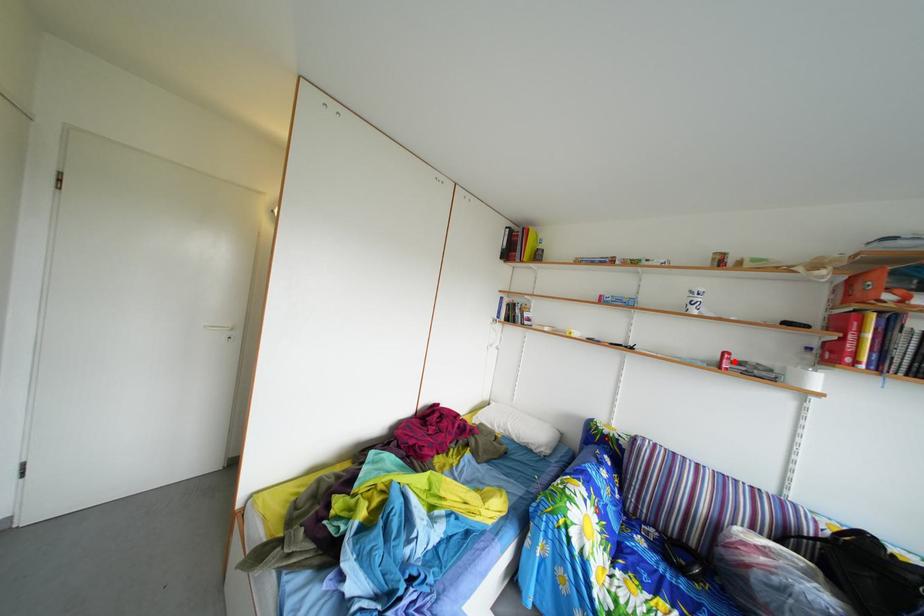
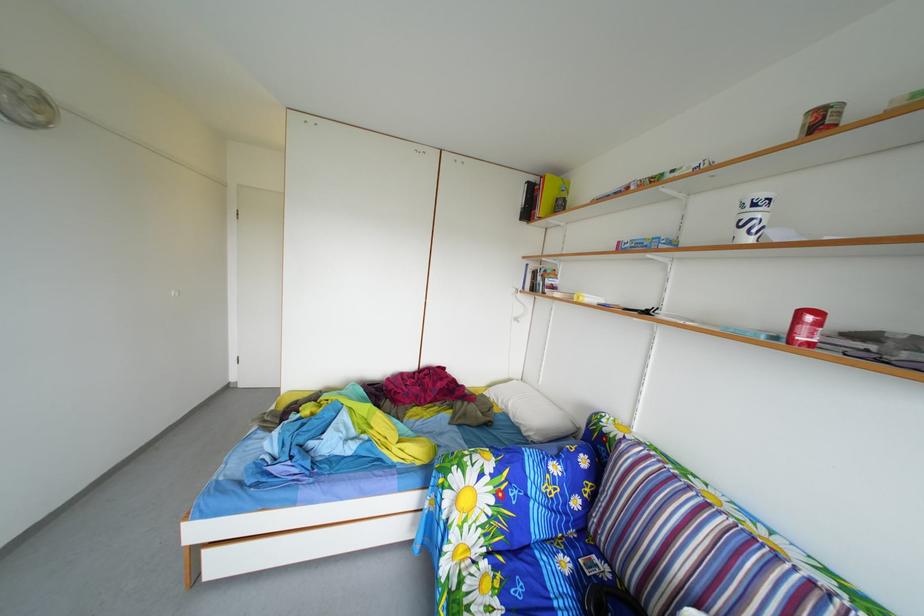
The point at the highlighted location is marked in the first image. Where is the corresponding point in the second image?

(811, 321)